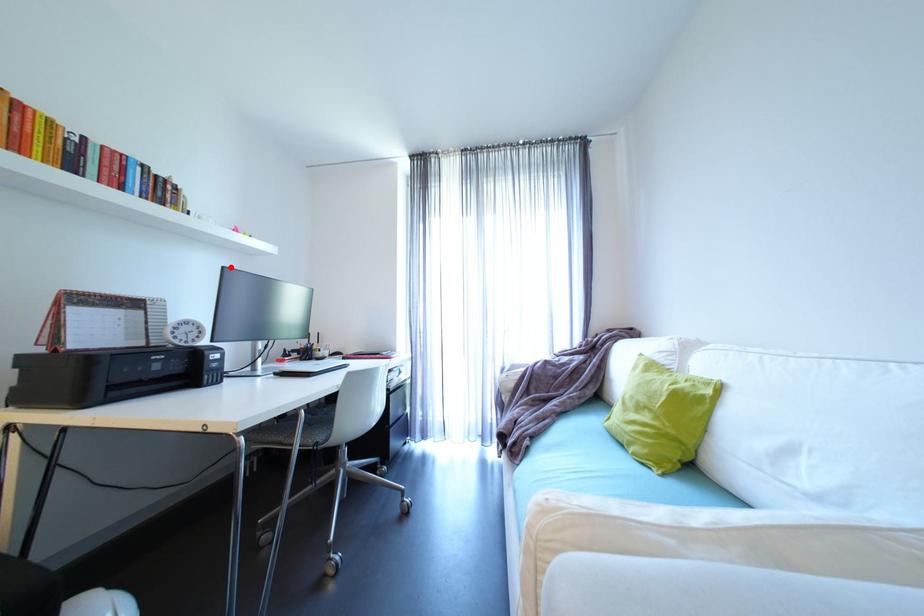
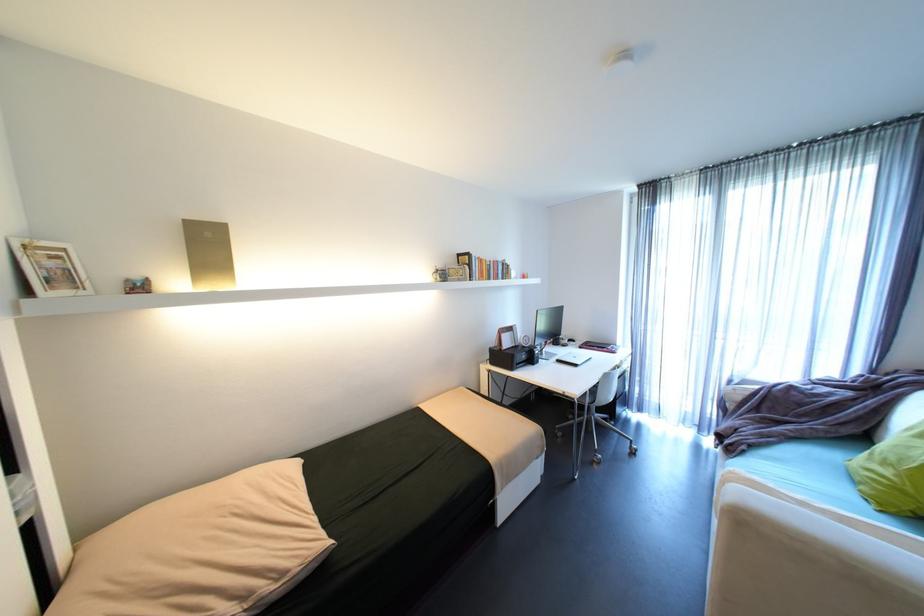
The point at the highlighted location is marked in the first image. Where is the corresponding point in the second image?

(544, 310)